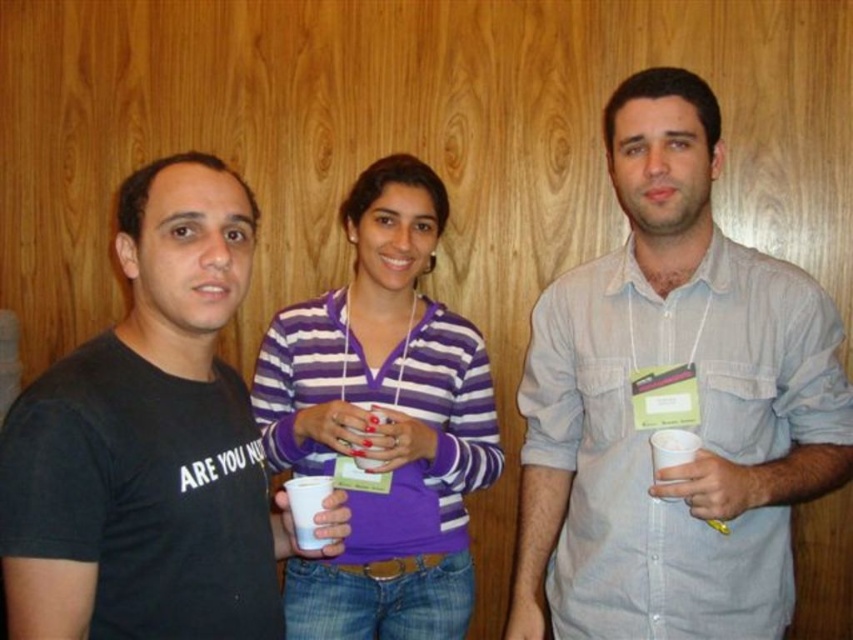
You are a photographer taking a picture of the scene. You want to focus on the white paper cup at center and the white paper cup at right. Which cup is closer to the camera?

The white paper cup at center is closer to the camera than the white paper cup at right.